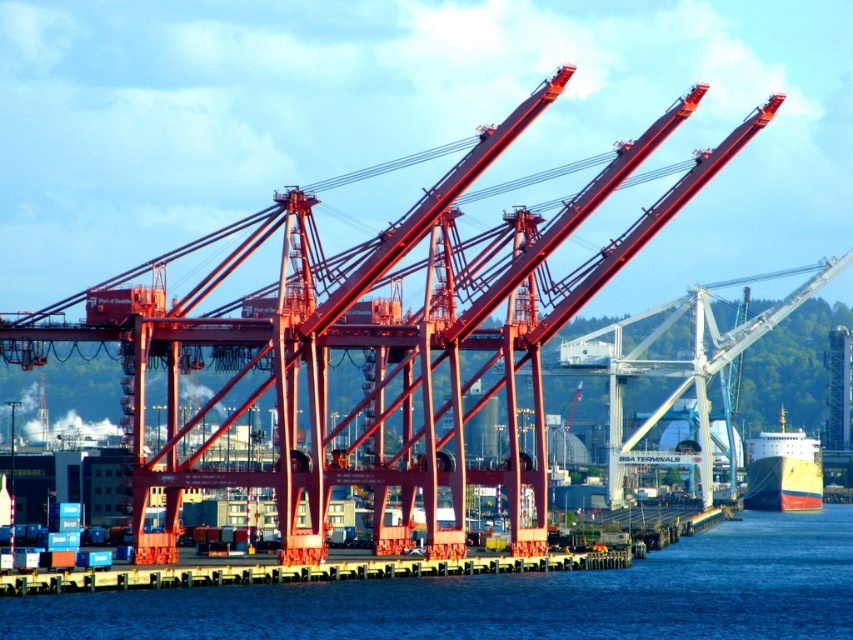
You are a crane operator at the port and need to secure the ship. You see the yellow matte dock at lower center and the yellow matte ship at lower right. Which one is positioned higher in the image?

The yellow matte dock at lower center is above the yellow matte ship at lower right, so it is positioned higher in the image.

You are a port authority inspector assessing the port layout. You need to determine if the blue water at lower center can accommodate the yellow matte ship at lower right based on their heights. What is your conclusion?

The blue water at lower center is not as tall as the yellow matte ship at lower right, meaning the water is shorter in height compared to the ship. Therefore, the blue water at lower center may not have sufficient depth to safely accommodate the yellow matte ship at lower right.

You are a harbor worker who needs to guide a new ship to the dock. You see the yellow matte dock at lower center and the yellow matte ship at lower right. Which one should you move towards to reach the dock first?

You should move towards the yellow matte dock at lower center first because it is positioned on the left side of the yellow matte ship at lower right, meaning it is closer to your current position.